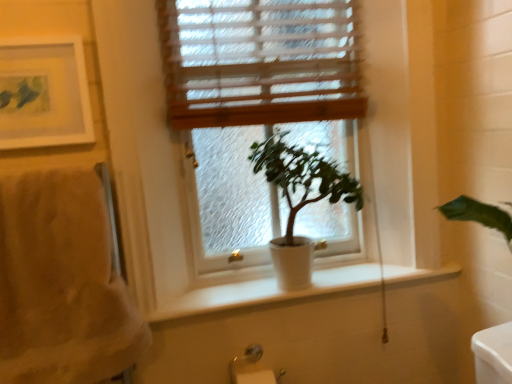
Question: From the image's perspective, relative to beige fluffy towel at left, is green matte plant at center above or below?

Choices:
 (A) above
 (B) below

Answer: (A)

Question: Is point (266, 163) positioned closer to the camera than point (53, 249)?

Choices:
 (A) farther
 (B) closer

Answer: (A)

Question: Which is farther from the white matte window at center?

Choices:
 (A) matte white picture frame at upper left
 (B) beige fluffy towel at left
 (C) green matte plant at center
 (D) silver metallic towel bar at lower left
 (E) wooden blinds at upper center

Answer: (D)

Question: Based on their relative distances, which object is farther from the beige fluffy towel at left?

Choices:
 (A) matte white picture frame at upper left
 (B) silver metallic towel bar at lower left
 (C) wooden blinds at upper center
 (D) white matte window at center
 (E) green matte plant at center

Answer: (C)